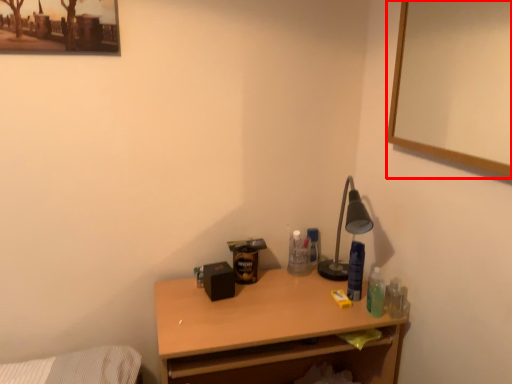
Question: Considering the relative positions of picture frame (annotated by the red box) and desk in the image provided, where is picture frame (annotated by the red box) located with respect to the staircase?

Choices:
 (A) right
 (B) left

Answer: (A)